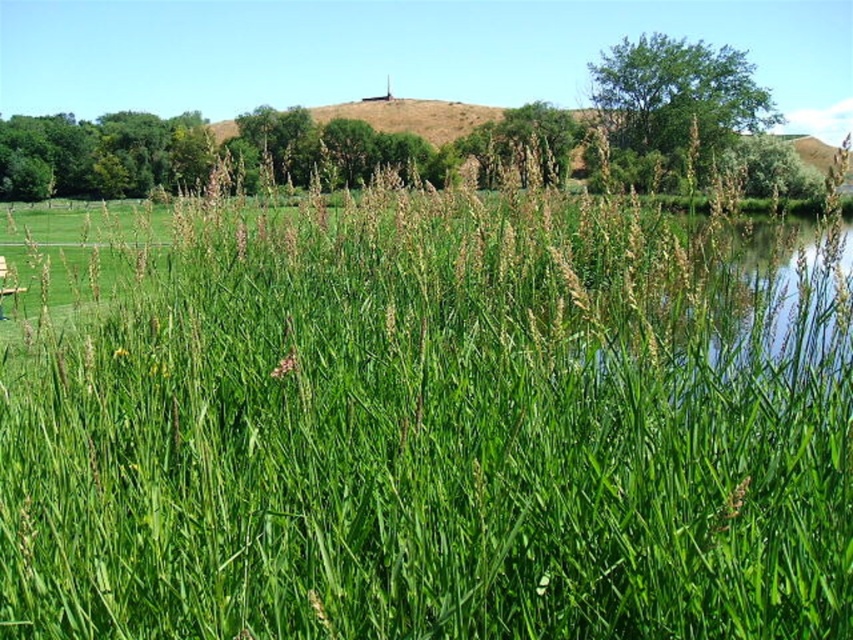
Question: Which of the following is the farthest from the observer?

Choices:
 (A) green leafy grass at center
 (B) wooden park bench at lower left

Answer: (A)

Question: Which object is closer to the camera taking this photo?

Choices:
 (A) wooden park bench at lower left
 (B) green leafy grass at center

Answer: (A)

Question: Considering the relative positions of green leafy grass at center and wooden park bench at lower left in the image provided, where is green leafy grass at center located with respect to wooden park bench at lower left?

Choices:
 (A) right
 (B) left

Answer: (A)

Question: Is green leafy grass at center below wooden park bench at lower left?

Choices:
 (A) yes
 (B) no

Answer: (B)

Question: Is green leafy grass at center positioned in front of wooden park bench at lower left?

Choices:
 (A) yes
 (B) no

Answer: (B)